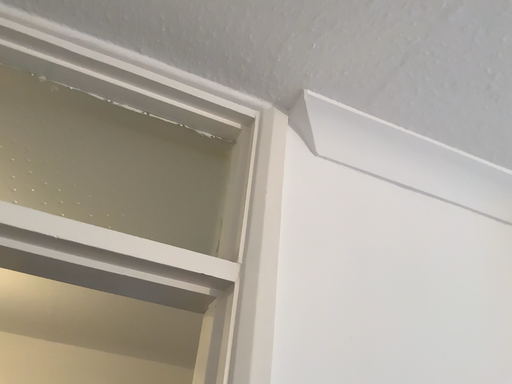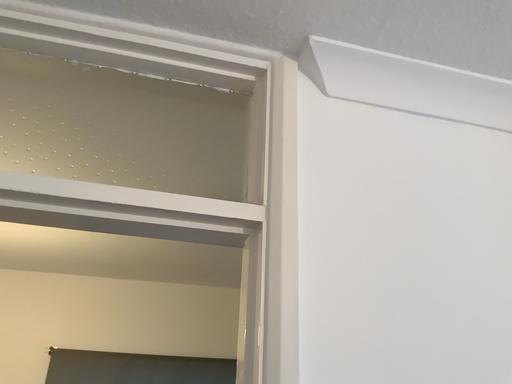
Question: How did the camera likely rotate when shooting the video?

Choices:
 (A) rotated downward
 (B) rotated upward

Answer: (A)